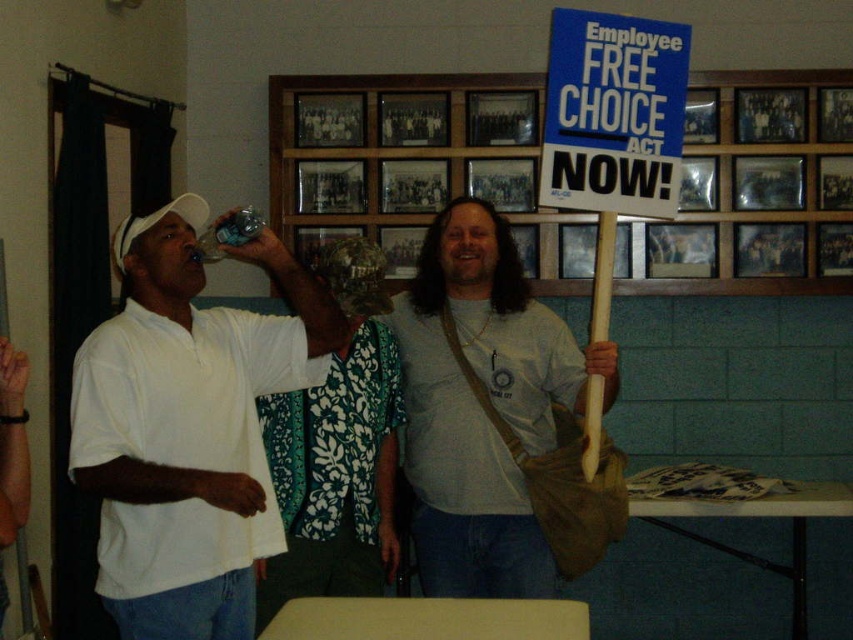
Based on the photo, you are a photographer trying to capture a candid shot of the light gray cotton shirt at center and the blue cardboard sign at upper center. Given that your camera has a maximum focus range of 3 feet, will you be able to focus on both subjects simultaneously?

The light gray cotton shirt at center and the blue cardboard sign at upper center are 3.72 feet apart. Since the distance between them exceeds the camera maximum focus range of 3 feet, you cannot focus on both subjects simultaneously.

You are organizing a photo shoot and need to ensure that all elements in the frame are clearly visible. Given the scene described, which object between the white matte shirt at left and the blue paper sign at upper right might be more challenging to capture in a focused manner due to its size, and why?

The blue paper sign at upper right might be more challenging to capture in a focused manner because the white matte shirt at left is bigger than it, making the smaller sign potentially harder to emphasize in the photo.